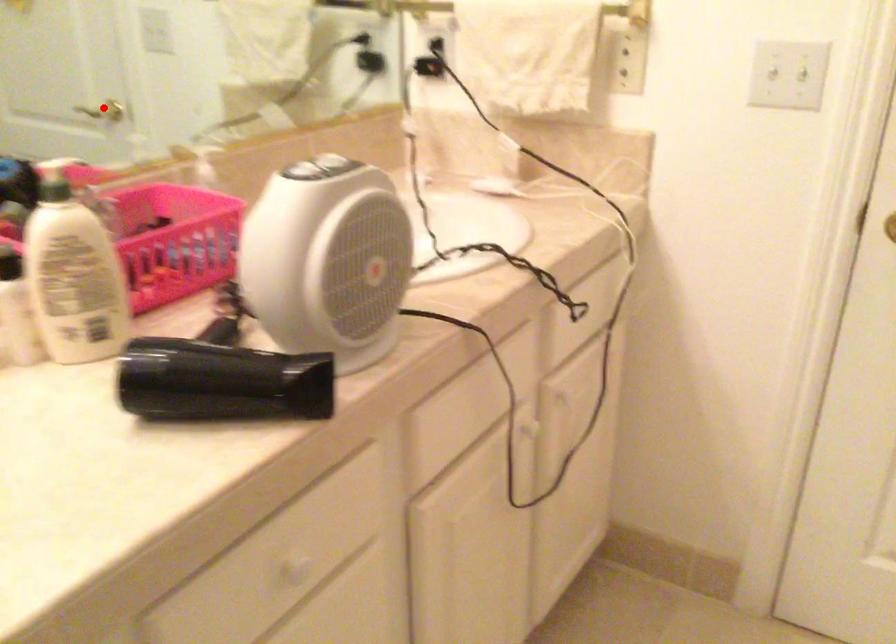
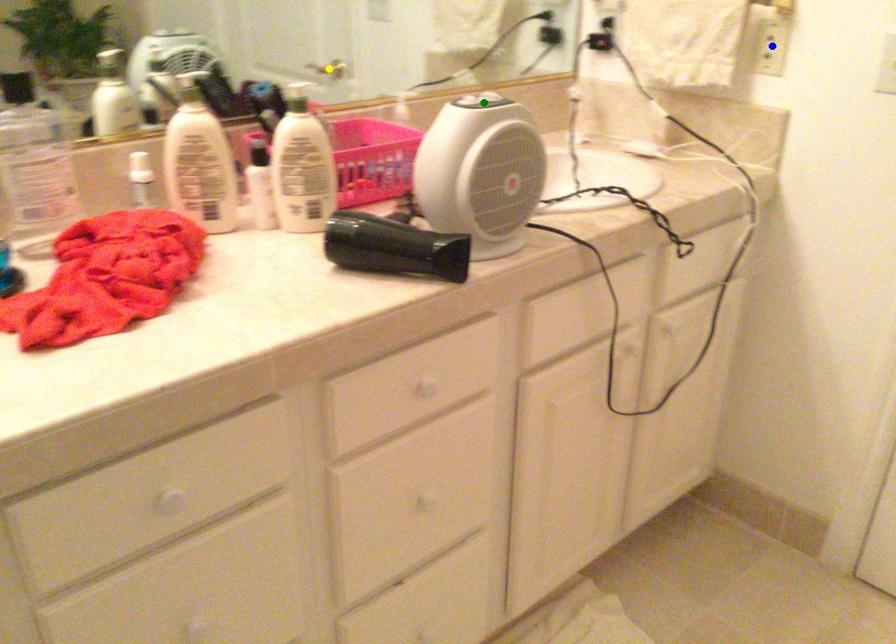
Question: I am providing you with two images of the same scene from different viewpoints. A red point is marked on the first image. You are given multiple points on the second image. Can you choose the point in image 2 that corresponds to the point in image 1?

Choices:
 (A) green point
 (B) yellow point
 (C) blue point

Answer: (B)